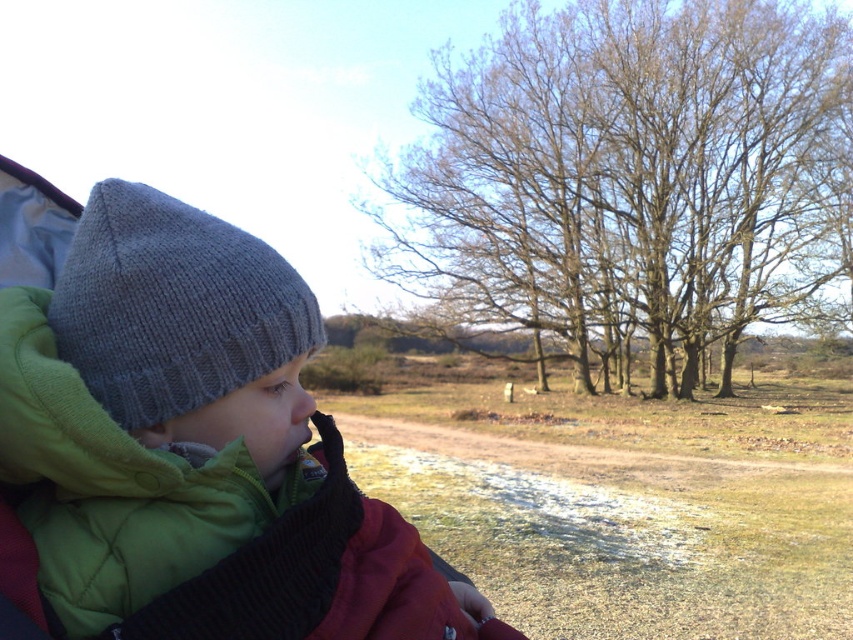
Is knitted woolen hat at upper left thinner than bare branches at upper center?

Indeed, knitted woolen hat at upper left has a lesser width compared to bare branches at upper center.

Is knitted woolen hat at upper left to the left of bare branches at upper center from the viewer's perspective?

Yes, knitted woolen hat at upper left is to the left of bare branches at upper center.

What do you see at coordinates (190, 451) in the screenshot? I see `knitted woolen hat at upper left` at bounding box center [190, 451].

Find the location of `knitted woolen hat at upper left`. knitted woolen hat at upper left is located at coordinates (190, 451).

Is knitted woolen hat at upper left shorter than gray knitted hat at left?

No.

Who is taller, knitted woolen hat at upper left or gray knitted hat at left?

knitted woolen hat at upper left

Between point (136, 480) and point (109, 317), which one is positioned behind?

Positioned behind is point (109, 317).

You are a GUI agent. You are given a task and a screenshot of the screen. Output one action in this format:
    pyautogui.click(x=<x>, y=<y>)
    Task: Click on the knitted woolen hat at upper left
    
    Given the screenshot: What is the action you would take?
    pyautogui.click(x=190, y=451)

Does bare branches at upper center appear on the left side of gray knitted hat at left?

No, bare branches at upper center is not to the left of gray knitted hat at left.

Does point (556, 259) lie in front of point (172, 340)?

No, (556, 259) is behind (172, 340).

Identify the location of bare branches at upper center. The height and width of the screenshot is (640, 853). (618, 172).